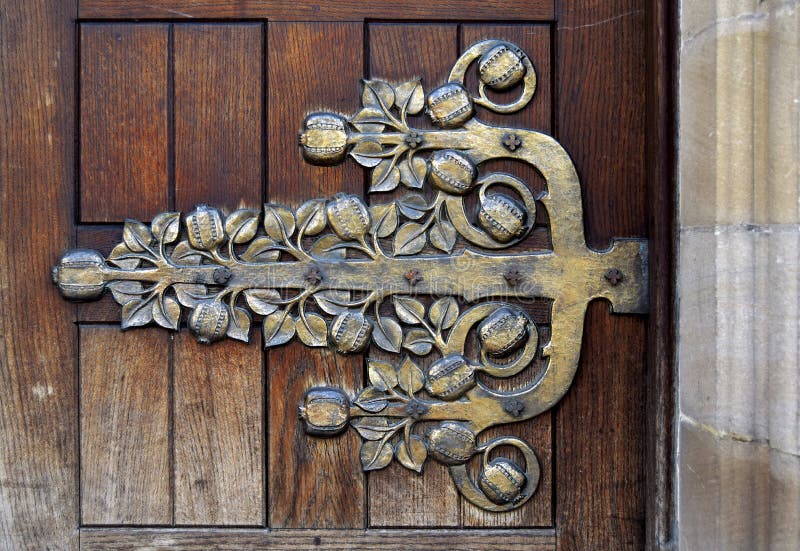
At what (x,y) coordinates should I click in order to perform the action: click on tops of candle stick. Please return your answer as a coordinate pair (x, y). This screenshot has width=800, height=551. Looking at the image, I should click on (334, 141), (316, 399), (82, 273).